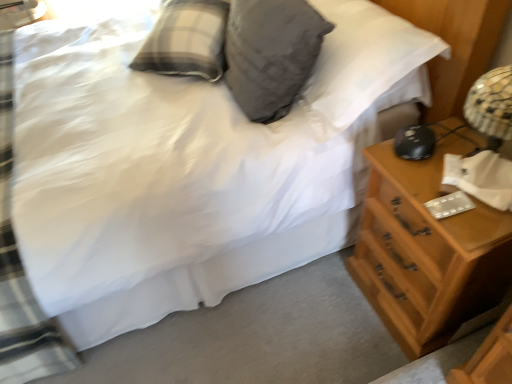
Question: Is wooden chest of drawers at right behind gray soft pillow at upper center?

Choices:
 (A) no
 (B) yes

Answer: (A)

Question: Considering the relative positions of wooden chest of drawers at right and gray soft pillow at upper center in the image provided, is wooden chest of drawers at right to the right of gray soft pillow at upper center from the viewer's perspective?

Choices:
 (A) no
 (B) yes

Answer: (B)

Question: Is wooden chest of drawers at right looking in the opposite direction of gray soft pillow at upper center?

Choices:
 (A) no
 (B) yes

Answer: (A)

Question: Considering the relative positions of wooden chest of drawers at right and gray soft pillow at upper center in the image provided, is wooden chest of drawers at right to the left of gray soft pillow at upper center from the viewer's perspective?

Choices:
 (A) no
 (B) yes

Answer: (A)

Question: Can gray soft pillow at upper center be found inside wooden chest of drawers at right?

Choices:
 (A) no
 (B) yes

Answer: (A)

Question: From the image's perspective, is wooden chest of drawers at right located beneath gray soft pillow at upper center?

Choices:
 (A) no
 (B) yes

Answer: (B)

Question: Is gray soft pillow at upper center surrounding wooden chest of drawers at right?

Choices:
 (A) no
 (B) yes

Answer: (A)

Question: Are gray soft pillow at upper center and wooden chest of drawers at right located far from each other?

Choices:
 (A) yes
 (B) no

Answer: (B)

Question: Is gray soft pillow at upper center thinner than wooden chest of drawers at right?

Choices:
 (A) yes
 (B) no

Answer: (A)

Question: From a real-world perspective, is gray soft pillow at upper center located higher than wooden chest of drawers at right?

Choices:
 (A) no
 (B) yes

Answer: (B)

Question: Is gray soft pillow at upper center not inside wooden chest of drawers at right?

Choices:
 (A) yes
 (B) no

Answer: (A)

Question: Does gray soft pillow at upper center appear on the left side of wooden chest of drawers at right?

Choices:
 (A) yes
 (B) no

Answer: (A)

Question: Is gray soft pillow at upper center taller or shorter than wooden chest of drawers at right?

Choices:
 (A) tall
 (B) short

Answer: (B)